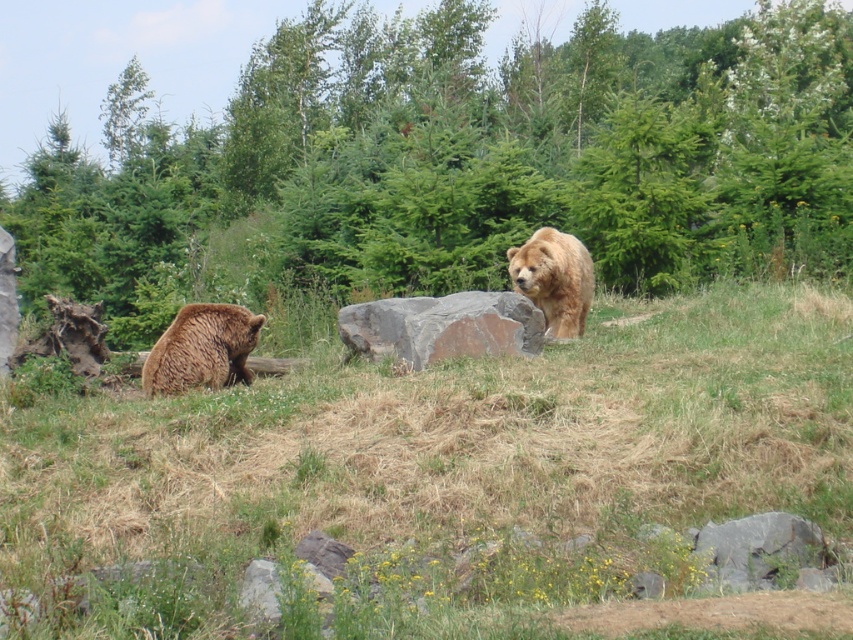
Can you confirm if green leafy tree at center is positioned to the right of golden fur bear at center?

Yes, green leafy tree at center is to the right of golden fur bear at center.

Is green leafy tree at center closer to the viewer compared to golden fur bear at center?

That is False.

Does point (386, 22) come behind point (582, 332)?

Yes, it is behind point (582, 332).

You are a GUI agent. You are given a task and a screenshot of the screen. Output one action in this format:
    pyautogui.click(x=<x>, y=<y>)
    Task: Click on the green leafy tree at center
    Image resolution: width=853 pixels, height=640 pixels.
    Given the screenshot: What is the action you would take?
    pyautogui.click(x=463, y=160)

Which of these two, green leafy tree at center or gray rough rock at center, stands shorter?

gray rough rock at center

Which is behind, point (474, 74) or point (457, 352)?

The point (474, 74) is behind.

Locate an element on the screen. Image resolution: width=853 pixels, height=640 pixels. green leafy tree at center is located at coordinates (463, 160).

At what (x,y) coordinates should I click in order to perform the action: click on green leafy tree at center. Please return your answer as a coordinate pair (x, y). Looking at the image, I should click on (463, 160).

Can you confirm if brown furry grass at center is positioned above golden fur bear at center?

Incorrect, brown furry grass at center is not positioned above golden fur bear at center.

Between brown furry grass at center and golden fur bear at center, which one appears on the right side from the viewer's perspective?

Positioned to the right is golden fur bear at center.

Who is more forward, (x=132, y=468) or (x=584, y=305)?

Point (x=132, y=468) is more forward.

Find the location of a particular element. The width and height of the screenshot is (853, 640). brown furry grass at center is located at coordinates (436, 474).